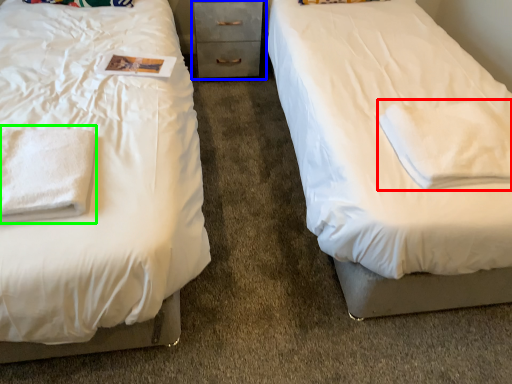
Question: Estimate the real-world distances between objects in this image. Which object is farther from cloth (highlighted by a red box), chest of drawers (highlighted by a blue box) or cloth (highlighted by a green box)?

Choices:
 (A) chest of drawers
 (B) cloth

Answer: (A)